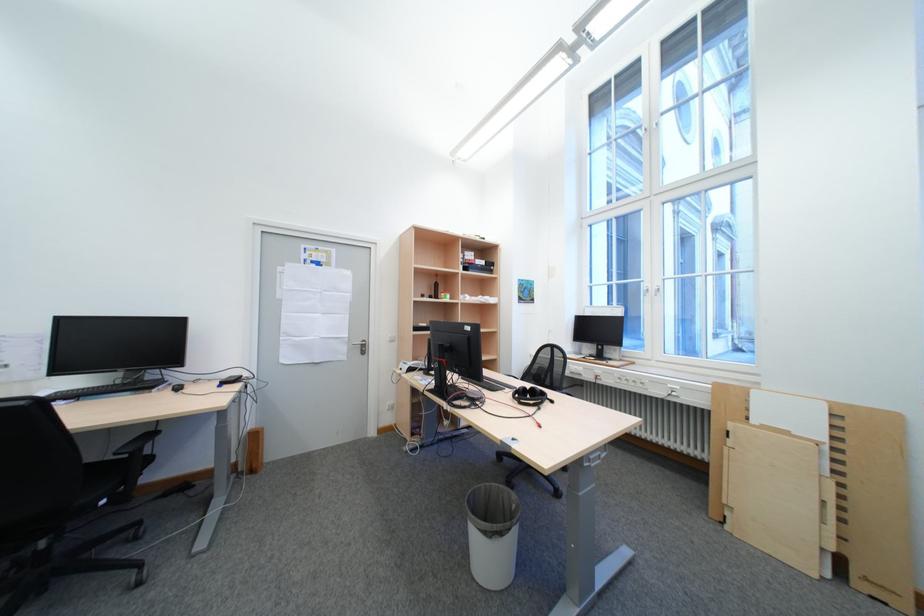
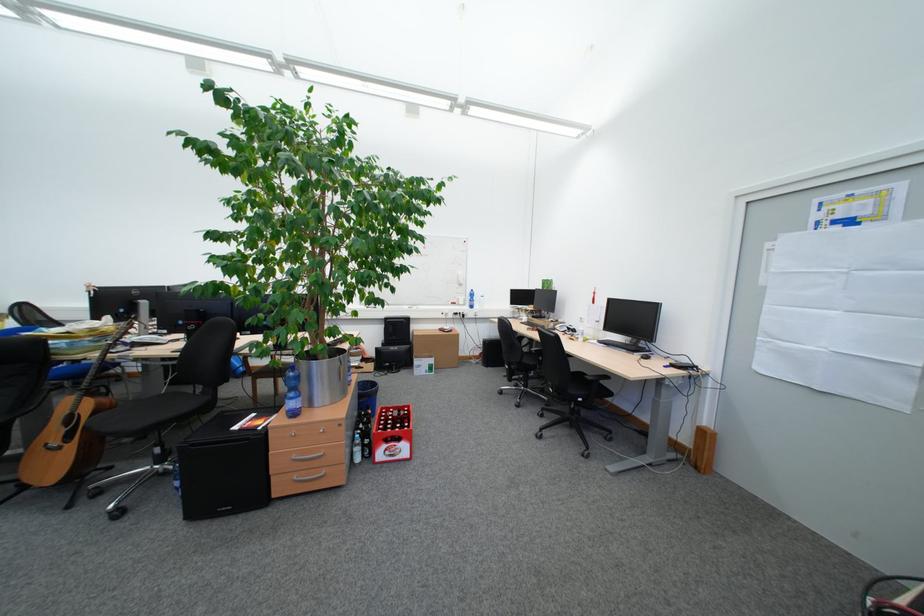
Locate, in the second image, the point that corresponds to (x=190, y=389) in the first image.

(658, 359)